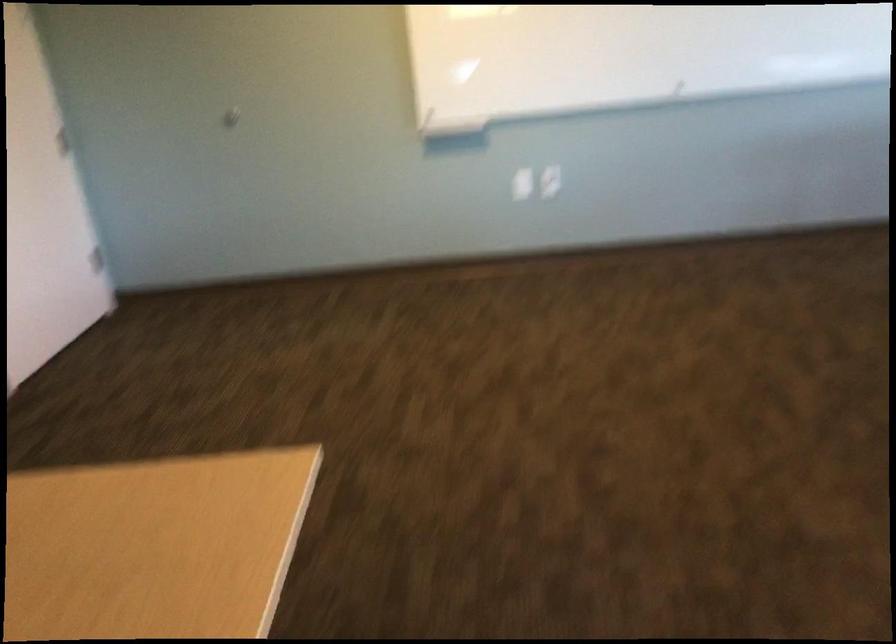
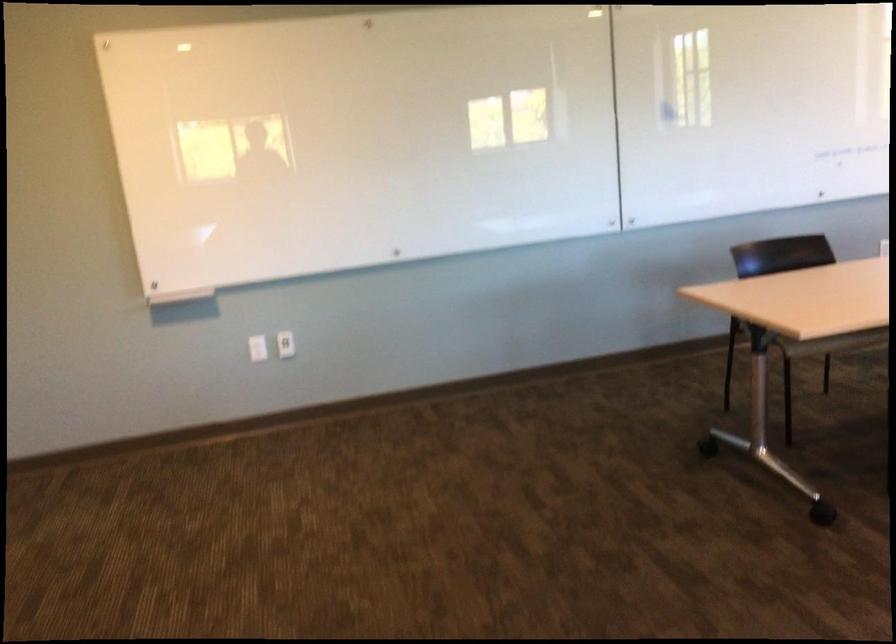
What movement of the cameraman would produce the second image?

The cameraman moved toward right, backward.